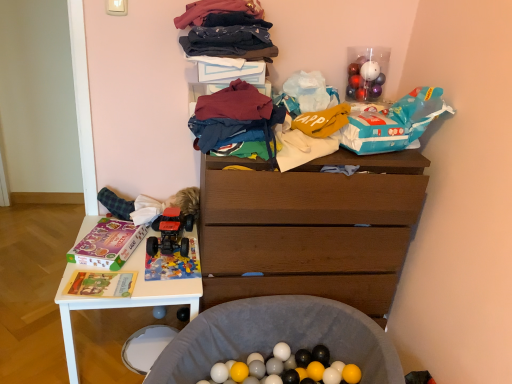
I want to click on empty space that is ontop of white plastic desk at lower left (from a real-world perspective), so click(x=134, y=261).